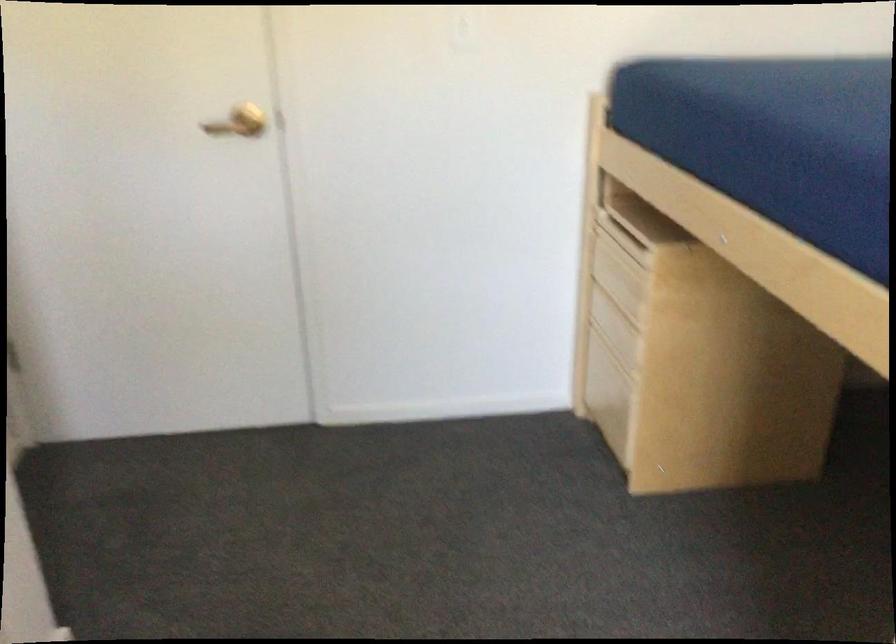
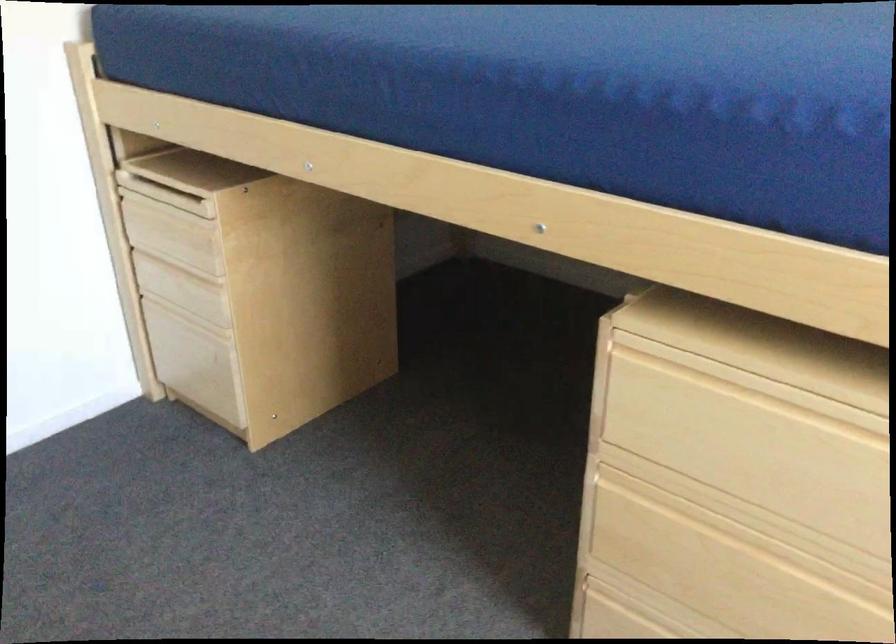
In the second image, find the point that corresponds to (659,265) in the first image.

(220, 214)